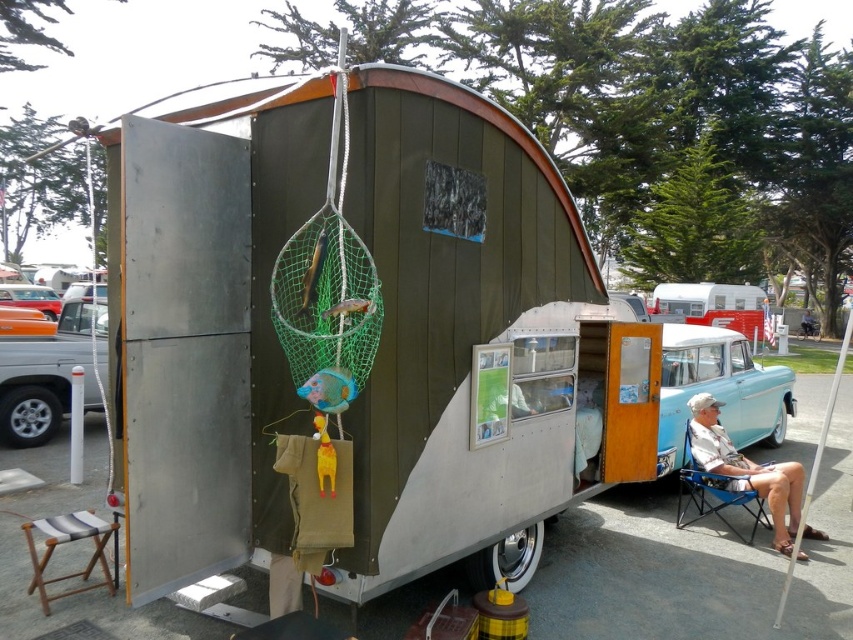
You are setting up a picnic area near the vintage teardrop trailer. You have a blue fabric chair at lower right and an orange matte car at left. Which object is narrower when viewed from above?

The blue fabric chair at lower right is thinner than the orange matte car at left, so the blue fabric chair at lower right is narrower when viewed from above.

You are a parking attendant and need to move the orange matte car at left and orange glossy car at left to a parking lot that requires a minimum of 12 feet between vehicles. Can both cars be parked there without violating the spacing requirement?

The orange matte car at left and orange glossy car at left are 13.05 feet apart from each other, which exceeds the minimum required 12 feet, so they can be parked there without violating the spacing requirement.